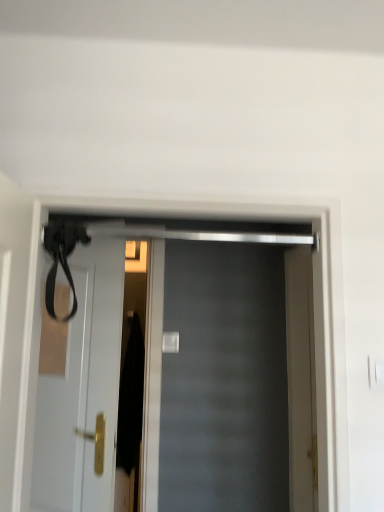
How much space does matte black door at center, which is counted as the first door, starting from the right, occupy horizontally?

5.40 inches.

The width and height of the screenshot is (384, 512). Describe the element at coordinates (176, 366) in the screenshot. I see `matte black door at center, placed as the 2th door when sorted from back to front` at that location.

This screenshot has width=384, height=512. I want to click on matte black door at center, which is counted as the first door, starting from the right, so 176,366.

Where is `white glossy door at upper left, which is the first door in back-to-front order`? white glossy door at upper left, which is the first door in back-to-front order is located at coordinates coord(80,387).

In order to face white glossy door at upper left, which appears as the 2th door when viewed from the front, should I rotate leftwards or rightwards?

A 15.795 degree turn to the left will do.

Image resolution: width=384 pixels, height=512 pixels. Describe the element at coordinates (80, 387) in the screenshot. I see `white glossy door at upper left, which appears as the 2th door when viewed from the front` at that location.

At what (x,y) coordinates should I click in order to perform the action: click on matte black door at center, positioned as the 1th door in front-to-back order. Please return your answer as a coordinate pair (x, y). Looking at the image, I should click on (176, 366).

Is white glossy door at upper left, which is the first door in back-to-front order, to the left of matte black door at center, positioned as the 1th door in front-to-back order, from the viewer's perspective?

Yes, white glossy door at upper left, which is the first door in back-to-front order, is to the left of matte black door at center, positioned as the 1th door in front-to-back order.

Does white glossy door at upper left, which is the first door in back-to-front order, lie behind matte black door at center, the 2th door from the left?

Yes, the depth of white glossy door at upper left, which is the first door in back-to-front order, is greater than that of matte black door at center, the 2th door from the left.

Which point is more distant from viewer, (x=95, y=276) or (x=138, y=343)?

Positioned behind is point (x=138, y=343).

From the image's perspective, is white glossy door at upper left, the first door from the left, positioned above or below matte black door at center, placed as the 2th door when sorted from back to front?

From the image's perspective, white glossy door at upper left, the first door from the left, appears below matte black door at center, placed as the 2th door when sorted from back to front.

From a real-world perspective, is white glossy door at upper left, which is the second door in right-to-left order, physically located above or below matte black door at center, positioned as the 1th door in front-to-back order?

In terms of real-world spatial position, white glossy door at upper left, which is the second door in right-to-left order, is below matte black door at center, positioned as the 1th door in front-to-back order.

Which object is thinner, white glossy door at upper left, which appears as the 2th door when viewed from the front, or matte black door at center, positioned as the 1th door in front-to-back order?

white glossy door at upper left, which appears as the 2th door when viewed from the front.

In terms of height, does white glossy door at upper left, the first door from the left, look taller or shorter compared to matte black door at center, which is counted as the first door, starting from the right?

Clearly, white glossy door at upper left, the first door from the left, is taller compared to matte black door at center, which is counted as the first door, starting from the right.

Considering the relative sizes of white glossy door at upper left, which is the first door in back-to-front order, and matte black door at center, placed as the 2th door when sorted from back to front, in the image provided, is white glossy door at upper left, which is the first door in back-to-front order, bigger than matte black door at center, placed as the 2th door when sorted from back to front,?

Incorrect, white glossy door at upper left, which is the first door in back-to-front order, is not larger than matte black door at center, placed as the 2th door when sorted from back to front.

Can we say white glossy door at upper left, which is the second door in right-to-left order, lies outside matte black door at center, which is counted as the first door, starting from the right?

Indeed, white glossy door at upper left, which is the second door in right-to-left order, is completely outside matte black door at center, which is counted as the first door, starting from the right.

Are white glossy door at upper left, which appears as the 2th door when viewed from the front, and matte black door at center, placed as the 2th door when sorted from back to front, far apart?

They are positioned close to each other.

Is white glossy door at upper left, which appears as the 2th door when viewed from the front, oriented towards matte black door at center, placed as the 2th door when sorted from back to front?

No, white glossy door at upper left, which appears as the 2th door when viewed from the front, is not facing towards matte black door at center, placed as the 2th door when sorted from back to front.

How many degrees apart are the facing directions of white glossy door at upper left, the first door from the left, and matte black door at center, placed as the 2th door when sorted from back to front?

white glossy door at upper left, the first door from the left, and matte black door at center, placed as the 2th door when sorted from back to front, are facing 28.6 degrees away from each other.

Find the location of a particular element. This screenshot has width=384, height=512. door in front of the white glossy door at upper left, which appears as the 2th door when viewed from the front is located at coordinates (176, 366).

Based on the photo, is matte black door at center, placed as the 2th door when sorted from back to front, at the right side of white glossy door at upper left, which is the first door in back-to-front order?

Yes, matte black door at center, placed as the 2th door when sorted from back to front, is to the right of white glossy door at upper left, which is the first door in back-to-front order.

Considering the positions of objects matte black door at center, placed as the 2th door when sorted from back to front, and white glossy door at upper left, the first door from the left, in the image provided, who is behind, matte black door at center, placed as the 2th door when sorted from back to front, or white glossy door at upper left, the first door from the left,?

white glossy door at upper left, the first door from the left, is more distant.

Is point (176, 465) behind point (112, 293)?

That is True.

From the image's perspective, is matte black door at center, placed as the 2th door when sorted from back to front, located above or below white glossy door at upper left, which is the first door in back-to-front order?

matte black door at center, placed as the 2th door when sorted from back to front, is situated higher than white glossy door at upper left, which is the first door in back-to-front order, in the image.

From a real-world perspective, is matte black door at center, positioned as the 1th door in front-to-back order, on white glossy door at upper left, which is the second door in right-to-left order?

Yes, from a real-world perspective, matte black door at center, positioned as the 1th door in front-to-back order, is over white glossy door at upper left, which is the second door in right-to-left order

Which object is thinner, matte black door at center, which is counted as the first door, starting from the right, or white glossy door at upper left, which is the first door in back-to-front order?

white glossy door at upper left, which is the first door in back-to-front order, is thinner.

Considering the sizes of objects matte black door at center, positioned as the 1th door in front-to-back order, and white glossy door at upper left, which is the second door in right-to-left order, in the image provided, who is taller, matte black door at center, positioned as the 1th door in front-to-back order, or white glossy door at upper left, which is the second door in right-to-left order,?

Standing taller between the two is white glossy door at upper left, which is the second door in right-to-left order.

Can you confirm if matte black door at center, placed as the 2th door when sorted from back to front, is bigger than white glossy door at upper left, the first door from the left?

Yes.

Is white glossy door at upper left, which is the second door in right-to-left order, surrounded by matte black door at center, the 2th door from the left?

Actually, white glossy door at upper left, which is the second door in right-to-left order, is outside matte black door at center, the 2th door from the left.

Are matte black door at center, the 2th door from the left, and white glossy door at upper left, which appears as the 2th door when viewed from the front, located far from each other?

That's not correct — matte black door at center, the 2th door from the left, is a little close to white glossy door at upper left, which appears as the 2th door when viewed from the front.

Is matte black door at center, placed as the 2th door when sorted from back to front, oriented towards white glossy door at upper left, which is the first door in back-to-front order?

No, matte black door at center, placed as the 2th door when sorted from back to front, is not turned towards white glossy door at upper left, which is the first door in back-to-front order.

What's the angular difference between matte black door at center, positioned as the 1th door in front-to-back order, and white glossy door at upper left, which appears as the 2th door when viewed from the front,'s facing directions?

The angular difference between matte black door at center, positioned as the 1th door in front-to-back order, and white glossy door at upper left, which appears as the 2th door when viewed from the front, is 28.6 degrees.

Locate an element on the screen. This screenshot has width=384, height=512. door below the matte black door at center, the 2th door from the left (from a real-world perspective) is located at coordinates (80, 387).

Locate an element on the screen. This screenshot has height=512, width=384. door located above the white glossy door at upper left, the first door from the left (from the image's perspective) is located at coordinates (176, 366).

This screenshot has height=512, width=384. I want to click on door lying on the left of matte black door at center, the 2th door from the left, so click(x=80, y=387).